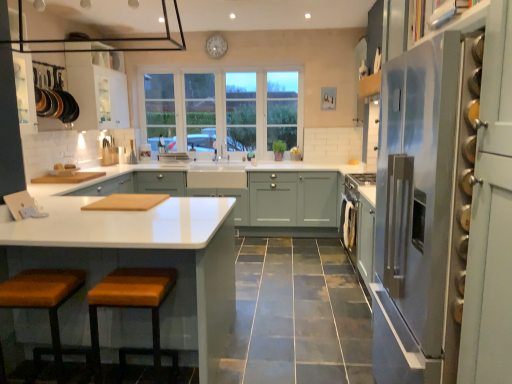
Question: Which direction should I rotate to look at white glossy countertop at center, which ranks as the 1th cabinetry in front-to-back order?

Choices:
 (A) right
 (B) left

Answer: (B)

Question: Is matte white cabinets at center, the second cabinetry viewed from the front, wider than black glass exhaust hood at upper center?

Choices:
 (A) no
 (B) yes

Answer: (B)

Question: Is matte white cabinets at center, the second cabinetry viewed from the front, oriented towards black glass exhaust hood at upper center?

Choices:
 (A) yes
 (B) no

Answer: (B)

Question: From the image's perspective, is matte white cabinets at center, marked as the first cabinetry in a back-to-front arrangement, under black glass exhaust hood at upper center?

Choices:
 (A) yes
 (B) no

Answer: (A)

Question: From a real-world perspective, is matte white cabinets at center, marked as the first cabinetry in a back-to-front arrangement, below black glass exhaust hood at upper center?

Choices:
 (A) no
 (B) yes

Answer: (B)

Question: Is matte white cabinets at center, marked as the first cabinetry in a back-to-front arrangement, looking in the opposite direction of black glass exhaust hood at upper center?

Choices:
 (A) yes
 (B) no

Answer: (B)

Question: Does matte white cabinets at center, marked as the first cabinetry in a back-to-front arrangement, touch black glass exhaust hood at upper center?

Choices:
 (A) yes
 (B) no

Answer: (B)

Question: Is the depth of white wood window at center greater than that of white glossy countertop at center, the second cabinetry in the back-to-front sequence?

Choices:
 (A) no
 (B) yes

Answer: (B)

Question: Does white wood window at center have a larger size compared to white glossy countertop at center, the second cabinetry in the back-to-front sequence?

Choices:
 (A) no
 (B) yes

Answer: (A)

Question: Is white wood window at center not near white glossy countertop at center, the second cabinetry in the back-to-front sequence?

Choices:
 (A) no
 (B) yes

Answer: (B)

Question: Is white wood window at center smaller than white glossy countertop at center, the second cabinetry in the back-to-front sequence?

Choices:
 (A) yes
 (B) no

Answer: (A)

Question: From a real-world perspective, does white wood window at center sit lower than white glossy countertop at center, which ranks as the 1th cabinetry in front-to-back order?

Choices:
 (A) no
 (B) yes

Answer: (A)

Question: Is white wood window at center oriented towards white glossy countertop at center, which ranks as the 1th cabinetry in front-to-back order?

Choices:
 (A) no
 (B) yes

Answer: (B)

Question: Does satin silver refrigerator at right have a greater height compared to white glossy drawer at center?

Choices:
 (A) yes
 (B) no

Answer: (A)